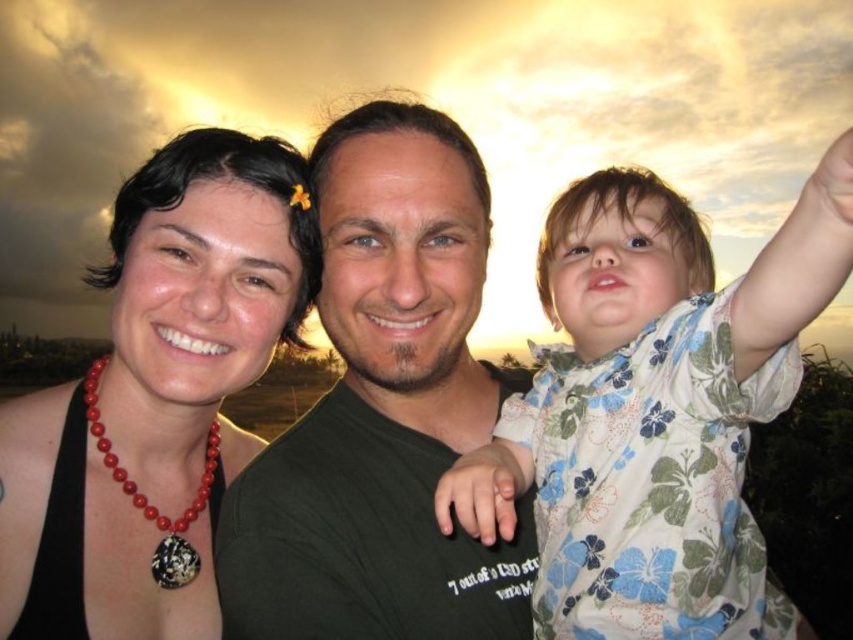
Question: Is matte coral necklace at upper left smaller than red beaded necklace at left?

Choices:
 (A) no
 (B) yes

Answer: (A)

Question: Is dark green t-shirt at center smaller than red beaded necklace at left?

Choices:
 (A) no
 (B) yes

Answer: (A)

Question: Considering the real-world distances, which object is closest to the floral fabric shirt at right?

Choices:
 (A) dark green t-shirt at center
 (B) matte coral necklace at upper left

Answer: (A)

Question: Which point appears farthest from the camera in this image?

Choices:
 (A) (180, 522)
 (B) (403, 196)
 (C) (103, 538)
 (D) (682, 342)

Answer: (A)

Question: Is floral fabric shirt at right closer to camera compared to red beaded necklace at left?

Choices:
 (A) no
 (B) yes

Answer: (B)

Question: Which point is closer to the camera?

Choices:
 (A) red beaded necklace at left
 (B) floral fabric shirt at right
 (C) dark green t-shirt at center
 (D) matte coral necklace at upper left

Answer: (B)